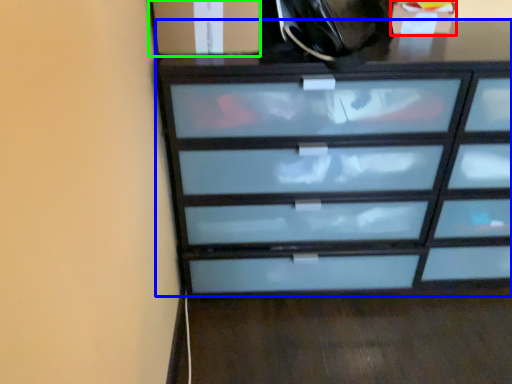
Question: Which is nearer to the cabinetry (highlighted by a red box)? chest of drawers (highlighted by a blue box) or cabinetry (highlighted by a green box).

Choices:
 (A) chest of drawers
 (B) cabinetry

Answer: (A)